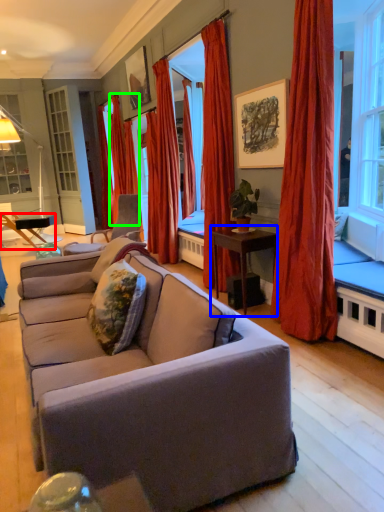
Question: Based on their relative distances, which object is farther from table (highlighted by a red box)? Choose from table (highlighted by a blue box) and curtain (highlighted by a green box).

Choices:
 (A) table
 (B) curtain

Answer: (A)